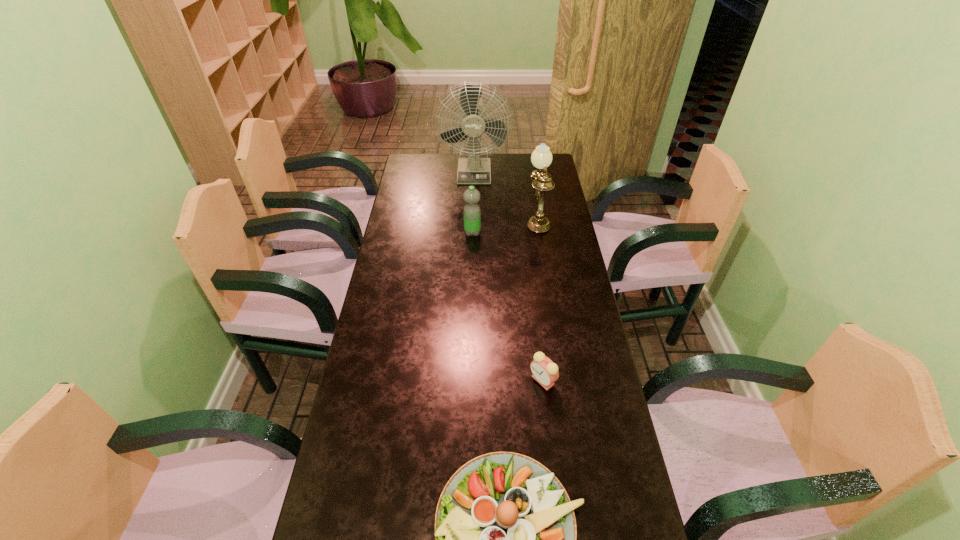
Image resolution: width=960 pixels, height=540 pixels. I want to click on object that ranks as the third closest to the salad plate, so click(x=541, y=158).

Locate an element on the screen. The image size is (960, 540). blank space that satisfies the following two spatial constraints: 1. on the air flow direction of the oil lamp; 2. on the left side of the farthest object is located at coordinates (473, 218).

What are the coordinates of `blank space that satisfies the following two spatial constraints: 1. on the back side of the oil lamp; 2. on the left side of the water bottle` in the screenshot? It's located at (472, 218).

Identify the location of vacant region that satisfies the following two spatial constraints: 1. on the front side of the oil lamp; 2. on the face of the alarm clock. Image resolution: width=960 pixels, height=540 pixels. (563, 380).

Find the location of a particular element. blank area in the image that satisfies the following two spatial constraints: 1. on the air flow direction of the second tallest object; 2. on the right side of the tallest object is located at coordinates (473, 218).